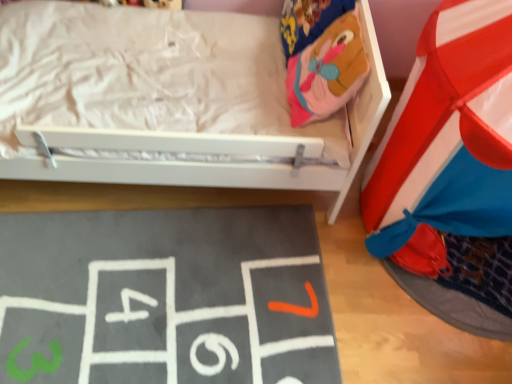
What do you see at coordinates (327, 71) in the screenshot? I see `velvet pink plush bean bag at upper right` at bounding box center [327, 71].

What are the coordinates of `velvet pink plush bean bag at upper right` in the screenshot? It's located at click(x=327, y=71).

What is the approximate width of velvet pink plush bean bag at upper right?

velvet pink plush bean bag at upper right is 21.13 centimeters in width.

Identify the location of gray felt hopscotch at lower left. The height and width of the screenshot is (384, 512). (165, 298).

The width and height of the screenshot is (512, 384). What do you see at coordinates (165, 298) in the screenshot?
I see `gray felt hopscotch at lower left` at bounding box center [165, 298].

Measure the distance between gray felt hopscotch at lower left and camera.

gray felt hopscotch at lower left and camera are 4.25 feet apart.

Identify the location of velvet pink plush bean bag at upper right. (327, 71).

Between gray felt hopscotch at lower left and velvet pink plush bean bag at upper right, which one appears on the left side from the viewer's perspective?

gray felt hopscotch at lower left is more to the left.

Which is in front, gray felt hopscotch at lower left or velvet pink plush bean bag at upper right?

gray felt hopscotch at lower left.

Which is in front, point (164, 259) or point (359, 31)?

Point (359, 31)

From the image's perspective, between gray felt hopscotch at lower left and velvet pink plush bean bag at upper right, who is located below?

From the image's view, gray felt hopscotch at lower left is below.

From a real-world perspective, is gray felt hopscotch at lower left located beneath velvet pink plush bean bag at upper right?

Yes, from a real-world perspective, gray felt hopscotch at lower left is below velvet pink plush bean bag at upper right.

Considering the relative sizes of gray felt hopscotch at lower left and velvet pink plush bean bag at upper right in the image provided, is gray felt hopscotch at lower left wider than velvet pink plush bean bag at upper right?

Yes.

Does gray felt hopscotch at lower left have a greater height compared to velvet pink plush bean bag at upper right?

No.

In terms of size, does gray felt hopscotch at lower left appear bigger or smaller than velvet pink plush bean bag at upper right?

Considering their sizes, gray felt hopscotch at lower left takes up less space than velvet pink plush bean bag at upper right.

Is velvet pink plush bean bag at upper right surrounded by gray felt hopscotch at lower left?

No, velvet pink plush bean bag at upper right is not surrounded by gray felt hopscotch at lower left.

Is gray felt hopscotch at lower left placed right next to velvet pink plush bean bag at upper right?

No, gray felt hopscotch at lower left is not with velvet pink plush bean bag at upper right.

Does gray felt hopscotch at lower left turn towards velvet pink plush bean bag at upper right?

No, gray felt hopscotch at lower left does not turn towards velvet pink plush bean bag at upper right.

How many degrees apart are the facing directions of gray felt hopscotch at lower left and velvet pink plush bean bag at upper right?

92.8 degrees.

Locate an element on the screen. bean bag chair lying behind the gray felt hopscotch at lower left is located at coordinates (327, 71).

Visually, is velvet pink plush bean bag at upper right positioned to the left or to the right of gray felt hopscotch at lower left?

From the image, it's evident that velvet pink plush bean bag at upper right is to the right of gray felt hopscotch at lower left.

Is velvet pink plush bean bag at upper right in front of or behind gray felt hopscotch at lower left in the image?

In the image, velvet pink plush bean bag at upper right appears behind gray felt hopscotch at lower left.

Does point (326, 104) lie behind point (313, 339)?

No, it is not.

From the image's perspective, would you say velvet pink plush bean bag at upper right is positioned over gray felt hopscotch at lower left?

Indeed, from the image's perspective, velvet pink plush bean bag at upper right is shown above gray felt hopscotch at lower left.

From a real-world perspective, who is located lower, velvet pink plush bean bag at upper right or gray felt hopscotch at lower left?

In real-world perspective, gray felt hopscotch at lower left is lower.

Considering the relative sizes of velvet pink plush bean bag at upper right and gray felt hopscotch at lower left in the image provided, is velvet pink plush bean bag at upper right thinner than gray felt hopscotch at lower left?

Yes, velvet pink plush bean bag at upper right is thinner than gray felt hopscotch at lower left.

Who is taller, velvet pink plush bean bag at upper right or gray felt hopscotch at lower left?

velvet pink plush bean bag at upper right is taller.

Based on their sizes in the image, would you say velvet pink plush bean bag at upper right is bigger or smaller than gray felt hopscotch at lower left?

Clearly, velvet pink plush bean bag at upper right is larger in size than gray felt hopscotch at lower left.

In the scene shown: Is velvet pink plush bean bag at upper right surrounding gray felt hopscotch at lower left?

No, gray felt hopscotch at lower left is not surrounded by velvet pink plush bean bag at upper right.

Are velvet pink plush bean bag at upper right and gray felt hopscotch at lower left beside each other?

No, velvet pink plush bean bag at upper right is not making contact with gray felt hopscotch at lower left.

Looking at this image, is gray felt hopscotch at lower left at the back of velvet pink plush bean bag at upper right?

That's not correct — velvet pink plush bean bag at upper right is not looking away from gray felt hopscotch at lower left.

Find the location of `bean bag chair behind the gray felt hopscotch at lower left`. bean bag chair behind the gray felt hopscotch at lower left is located at coordinates (327, 71).

Where is `bean bag chair that is on the right side of gray felt hopscotch at lower left`? The width and height of the screenshot is (512, 384). bean bag chair that is on the right side of gray felt hopscotch at lower left is located at coordinates 327,71.

Identify the location of bean bag chair behind the gray felt hopscotch at lower left. The width and height of the screenshot is (512, 384). point(327,71).